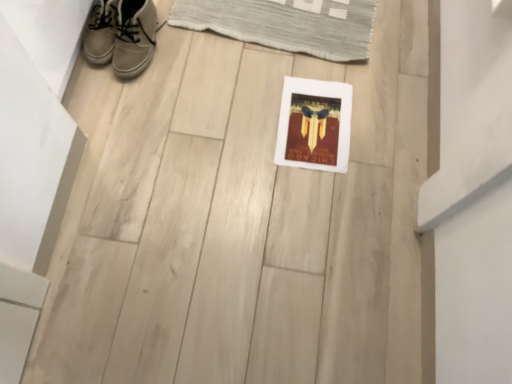
What is the approximate height of white leather sneakers at upper left, which is the 2th footwear from left to right?

The height of white leather sneakers at upper left, which is the 2th footwear from left to right, is 4.60 inches.

I want to click on white matte picture frame at center, so click(314, 125).

What are the coordinates of `leather sneaker at upper left, arranged as the first footwear when viewed from the left` in the screenshot? It's located at (101, 32).

Where is `white leather sneakers at upper left, the first footwear in the right-to-left sequence`? The height and width of the screenshot is (384, 512). white leather sneakers at upper left, the first footwear in the right-to-left sequence is located at coordinates (122, 35).

Is leather sneaker at upper left, arranged as the first footwear when viewed from the left, inside or outside of white leather sneakers at upper left, the first footwear in the right-to-left sequence?

leather sneaker at upper left, arranged as the first footwear when viewed from the left, lies outside white leather sneakers at upper left, the first footwear in the right-to-left sequence.

Where is `footwear below the leather sneaker at upper left, arranged as the first footwear when viewed from the left (from the image's perspective)`? The image size is (512, 384). footwear below the leather sneaker at upper left, arranged as the first footwear when viewed from the left (from the image's perspective) is located at coordinates (122, 35).

Who is shorter, leather sneaker at upper left, arranged as the first footwear when viewed from the left, or white leather sneakers at upper left, which is the 2th footwear from left to right?

leather sneaker at upper left, arranged as the first footwear when viewed from the left.

Which point is more distant from viewer, (89, 46) or (131, 52)?

Positioned behind is point (89, 46).

You are a GUI agent. You are given a task and a screenshot of the screen. Output one action in this format:
    pyautogui.click(x=<x>, y=<y>)
    Task: Click on the footwear above the white leather sneakers at upper left, the first footwear in the right-to-left sequence (from the image's perspective)
    The width and height of the screenshot is (512, 384).
    Given the screenshot: What is the action you would take?
    pyautogui.click(x=101, y=32)

Which of these two, white leather sneakers at upper left, which is the 2th footwear from left to right, or leather sneaker at upper left, the 2th footwear in the right-to-left sequence, stands shorter?

Standing shorter between the two is leather sneaker at upper left, the 2th footwear in the right-to-left sequence.

Which object is wider, white leather sneakers at upper left, the first footwear in the right-to-left sequence, or leather sneaker at upper left, arranged as the first footwear when viewed from the left?

With larger width is white leather sneakers at upper left, the first footwear in the right-to-left sequence.

Between white leather sneakers at upper left, which is the 2th footwear from left to right, and leather sneaker at upper left, arranged as the first footwear when viewed from the left, which one has smaller size?

Smaller between the two is leather sneaker at upper left, arranged as the first footwear when viewed from the left.

Considering the relative positions of white leather sneakers at upper left, the first footwear in the right-to-left sequence, and white matte picture frame at center in the image provided, is white leather sneakers at upper left, the first footwear in the right-to-left sequence, behind white matte picture frame at center?

No, white leather sneakers at upper left, the first footwear in the right-to-left sequence, is in front of white matte picture frame at center.

Is white leather sneakers at upper left, the first footwear in the right-to-left sequence, bigger or smaller than white matte picture frame at center?

Considering their sizes, white leather sneakers at upper left, the first footwear in the right-to-left sequence, takes up more space than white matte picture frame at center.

From the picture: Is white leather sneakers at upper left, which is the 2th footwear from left to right, shorter than white matte picture frame at center?

In fact, white leather sneakers at upper left, which is the 2th footwear from left to right, may be taller than white matte picture frame at center.

In the image, is white leather sneakers at upper left, which is the 2th footwear from left to right, on the left side or the right side of white matte picture frame at center?

From the image, it's evident that white leather sneakers at upper left, which is the 2th footwear from left to right, is to the left of white matte picture frame at center.

Considering the sizes of objects white matte picture frame at center and leather sneaker at upper left, arranged as the first footwear when viewed from the left, in the image provided, who is shorter, white matte picture frame at center or leather sneaker at upper left, arranged as the first footwear when viewed from the left,?

Standing shorter between the two is white matte picture frame at center.

Is white matte picture frame at center not inside leather sneaker at upper left, the 2th footwear in the right-to-left sequence?

Yes, white matte picture frame at center is not within leather sneaker at upper left, the 2th footwear in the right-to-left sequence.

Considering the positions of point (312, 96) and point (104, 22), is point (312, 96) closer or farther from the camera than point (104, 22)?

Point (312, 96).

Considering the positions of objects white matte picture frame at center and leather sneaker at upper left, the 2th footwear in the right-to-left sequence, in the image provided, who is more to the left, white matte picture frame at center or leather sneaker at upper left, the 2th footwear in the right-to-left sequence,?

Positioned to the left is leather sneaker at upper left, the 2th footwear in the right-to-left sequence.

Which is in front, leather sneaker at upper left, arranged as the first footwear when viewed from the left, or white matte picture frame at center?

leather sneaker at upper left, arranged as the first footwear when viewed from the left, is closer to the camera.

Are leather sneaker at upper left, the 2th footwear in the right-to-left sequence, and white matte picture frame at center far apart?

No, leather sneaker at upper left, the 2th footwear in the right-to-left sequence, is not far away from white matte picture frame at center.

From a real-world perspective, is leather sneaker at upper left, arranged as the first footwear when viewed from the left, over white matte picture frame at center?

Yes.

Is white matte picture frame at center positioned with its back to white leather sneakers at upper left, the first footwear in the right-to-left sequence?

No, white leather sneakers at upper left, the first footwear in the right-to-left sequence, is not at the back of white matte picture frame at center.

What's the angular difference between white matte picture frame at center and white leather sneakers at upper left, the first footwear in the right-to-left sequence,'s facing directions?

They differ by 89.3 degrees in their facing directions.

Is white matte picture frame at center situated inside white leather sneakers at upper left, the first footwear in the right-to-left sequence, or outside?

white matte picture frame at center is not inside white leather sneakers at upper left, the first footwear in the right-to-left sequence, it's outside.

Does white matte picture frame at center have a greater height compared to white leather sneakers at upper left, the first footwear in the right-to-left sequence?

No, white matte picture frame at center is not taller than white leather sneakers at upper left, the first footwear in the right-to-left sequence.

The width and height of the screenshot is (512, 384). I want to click on footwear in front of the leather sneaker at upper left, the 2th footwear in the right-to-left sequence, so click(x=122, y=35).

Locate an element on the screen. The image size is (512, 384). footwear above the white leather sneakers at upper left, which is the 2th footwear from left to right (from the image's perspective) is located at coordinates (101, 32).

From the image, which object appears to be nearer to white matte picture frame at center, white leather sneakers at upper left, which is the 2th footwear from left to right, or leather sneaker at upper left, arranged as the first footwear when viewed from the left?

Based on the image, white leather sneakers at upper left, which is the 2th footwear from left to right, appears to be nearer to white matte picture frame at center.

Looking at this image, which object lies nearer to the anchor point leather sneaker at upper left, the 2th footwear in the right-to-left sequence, white leather sneakers at upper left, the first footwear in the right-to-left sequence, or white matte picture frame at center?

The object closer to leather sneaker at upper left, the 2th footwear in the right-to-left sequence, is white leather sneakers at upper left, the first footwear in the right-to-left sequence.

Estimate the real-world distances between objects in this image. Which object is further from white matte picture frame at center, leather sneaker at upper left, the 2th footwear in the right-to-left sequence, or white leather sneakers at upper left, which is the 2th footwear from left to right?

Among the two, leather sneaker at upper left, the 2th footwear in the right-to-left sequence, is located further to white matte picture frame at center.

Based on their spatial positions, is white matte picture frame at center or leather sneaker at upper left, arranged as the first footwear when viewed from the left, further from white leather sneakers at upper left, the first footwear in the right-to-left sequence?

white matte picture frame at center is positioned further to the anchor white leather sneakers at upper left, the first footwear in the right-to-left sequence.

Looking at the image, which one is located closer to leather sneaker at upper left, the 2th footwear in the right-to-left sequence, white matte picture frame at center or white leather sneakers at upper left, which is the 2th footwear from left to right?

white leather sneakers at upper left, which is the 2th footwear from left to right, is positioned closer to the anchor leather sneaker at upper left, the 2th footwear in the right-to-left sequence.

When comparing their distances from white leather sneakers at upper left, which is the 2th footwear from left to right, does leather sneaker at upper left, the 2th footwear in the right-to-left sequence, or white matte picture frame at center seem further?

white matte picture frame at center is further to white leather sneakers at upper left, which is the 2th footwear from left to right.

Locate an element on the screen. Image resolution: width=512 pixels, height=384 pixels. footwear between leather sneaker at upper left, the 2th footwear in the right-to-left sequence, and white matte picture frame at center, in the horizontal direction is located at coordinates (122, 35).